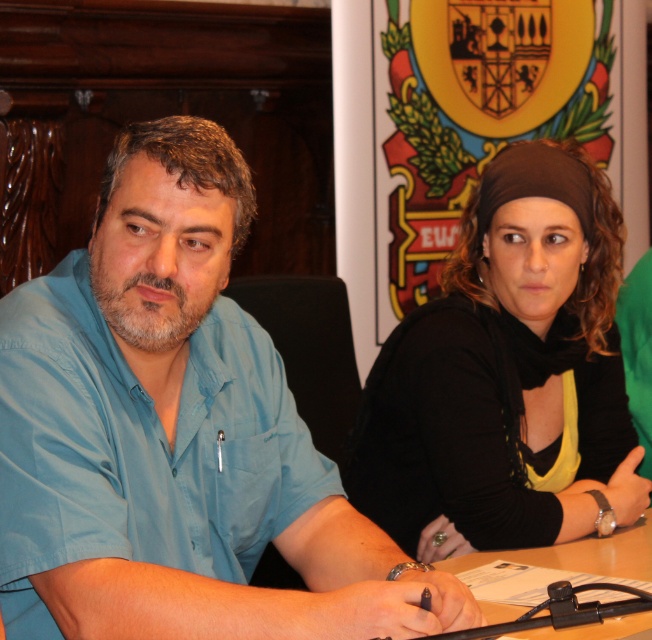
You are an interior designer assessing the height of objects in the room. The blue cotton shirt at left and the black matte headscarf at upper right are both visible in the image. Which object has a greater height?

The black matte headscarf at upper right is taller than the blue cotton shirt at left.

You are a photographer positioned behind the table in the scene. You want to take a photo that clearly shows both the blue cotton shirt at left and the black matte headscarf at upper right. Which object should you adjust your focus on first to ensure both are in clear view?

The blue cotton shirt at left is closer to the viewer than the black matte headscarf at upper right. To ensure both are in clear view, focus on the blue cotton shirt at left first, as it is the closer object, and adjust the focus range to include the black matte headscarf at upper right in the depth of field.

You are a photographer standing in the room and want to capture a closeup shot of the blue cotton shirt at left and the black matte headscarf at upper right in the same frame. Given that your camera has a maximum focus range of 25 inches, will you be able to focus on both subjects simultaneously?

The blue cotton shirt at left is 24.76 inches away from the black matte headscarf at upper right. Since the distance between them is within the camera maximum focus range of 25 inches, the photographer can focus on both subjects simultaneously.